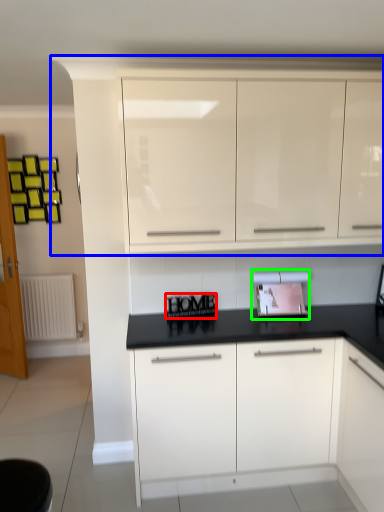
Question: Which object is the closest to the writing (highlighted by a red box)? Choose among these: cabinetry (highlighted by a blue box) or appliance (highlighted by a green box).

Choices:
 (A) cabinetry
 (B) appliance

Answer: (B)